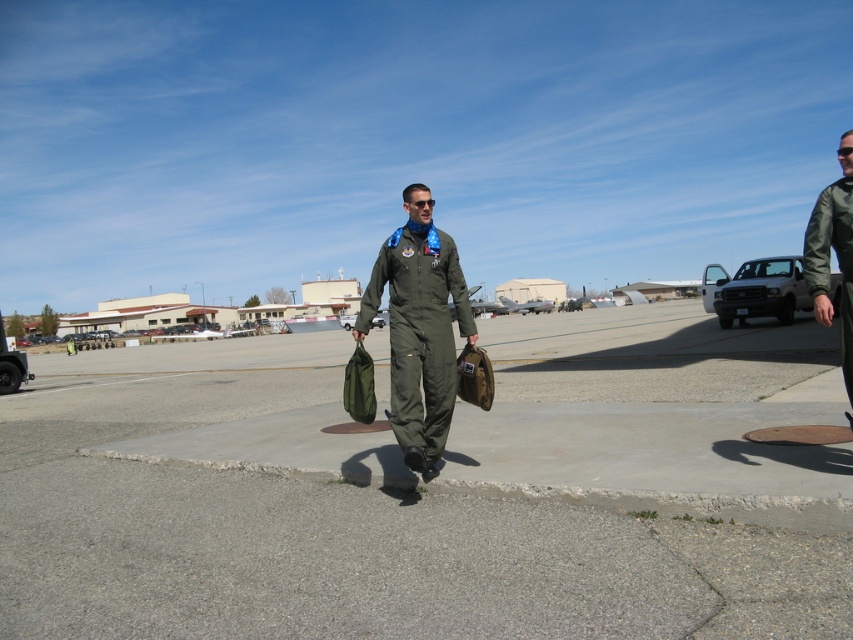
Question: Among these points, which one is farthest from the camera?

Choices:
 (A) (814, 234)
 (B) (427, 312)
 (C) (212, 552)

Answer: (B)

Question: Which object is closer to the camera taking this photo?

Choices:
 (A) green matte jumpsuit at center
 (B) green fabric bag at center

Answer: (B)

Question: Can you confirm if green matte jumpsuit at center is wider than green matte jacket at right?

Choices:
 (A) no
 (B) yes

Answer: (A)

Question: Does green fabric bag at center have a lesser width compared to green matte jumpsuit at center?

Choices:
 (A) yes
 (B) no

Answer: (B)

Question: From the image, what is the correct spatial relationship of green matte jumpsuit at center in relation to green matte jacket at right?

Choices:
 (A) above
 (B) below

Answer: (B)

Question: Which of the following is the farthest from the observer?

Choices:
 (A) green matte jumpsuit at center
 (B) green fabric bag at center

Answer: (A)